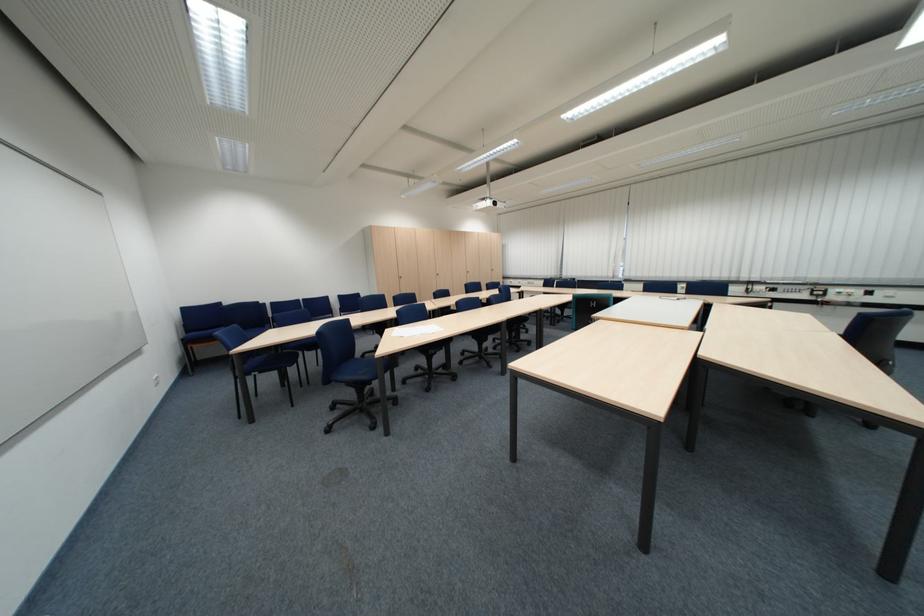
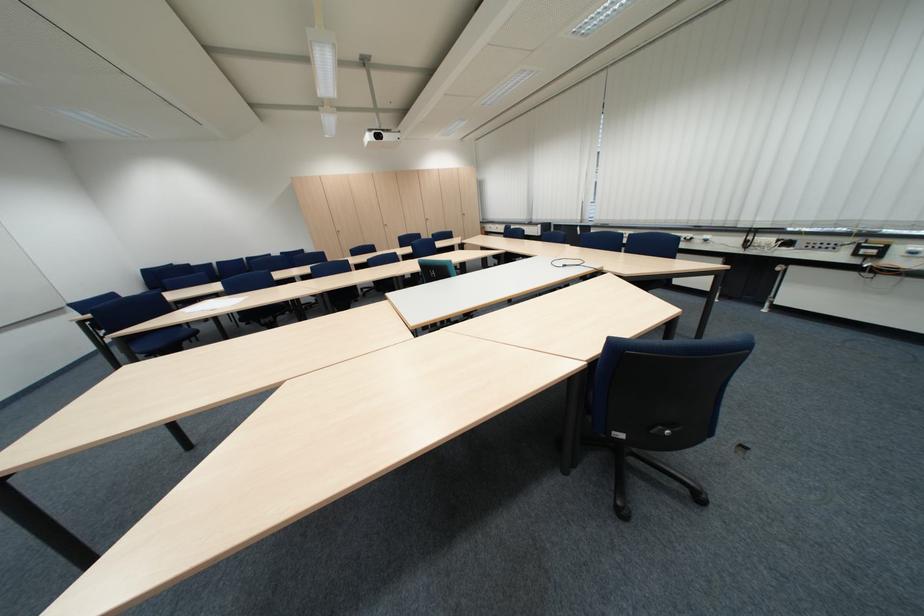
Question: In a continuous first-person perspective shot, in which direction is the camera moving?

Choices:
 (A) Left
 (B) Right
 (C) Forward
 (D) Backward

Answer: (B)